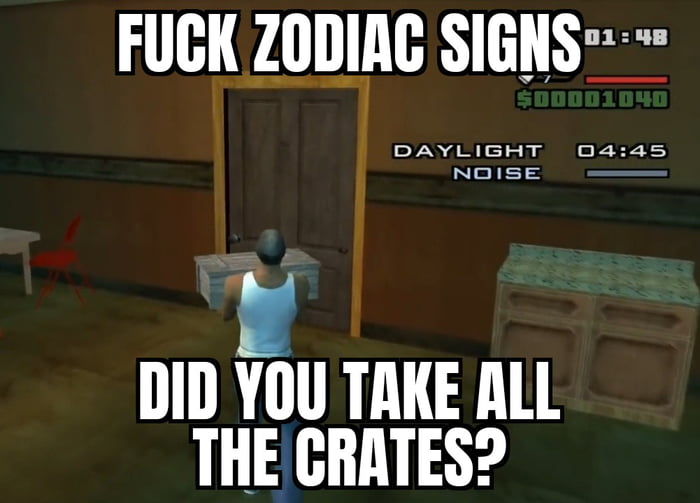
Where is `wall`? Image resolution: width=700 pixels, height=503 pixels. wall is located at coordinates (118, 103).